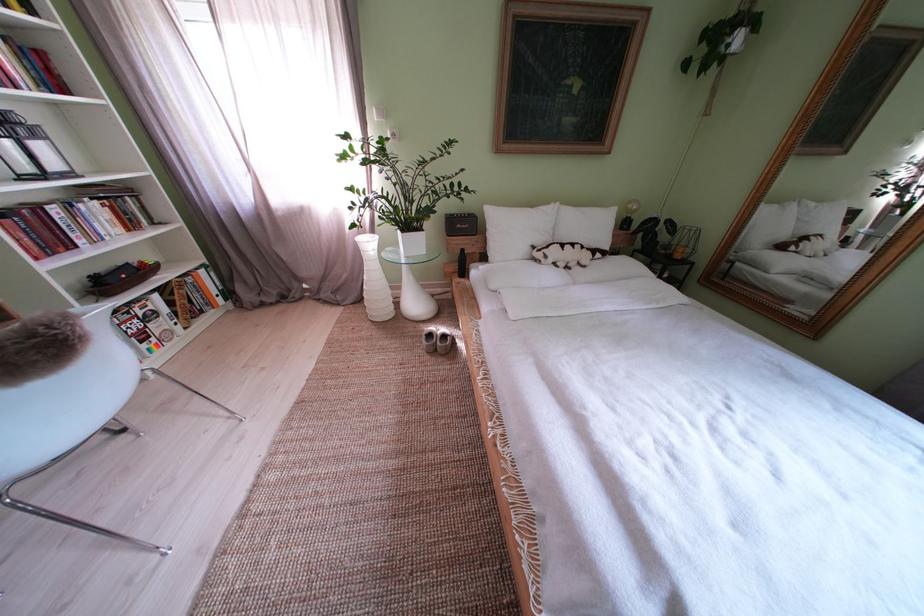
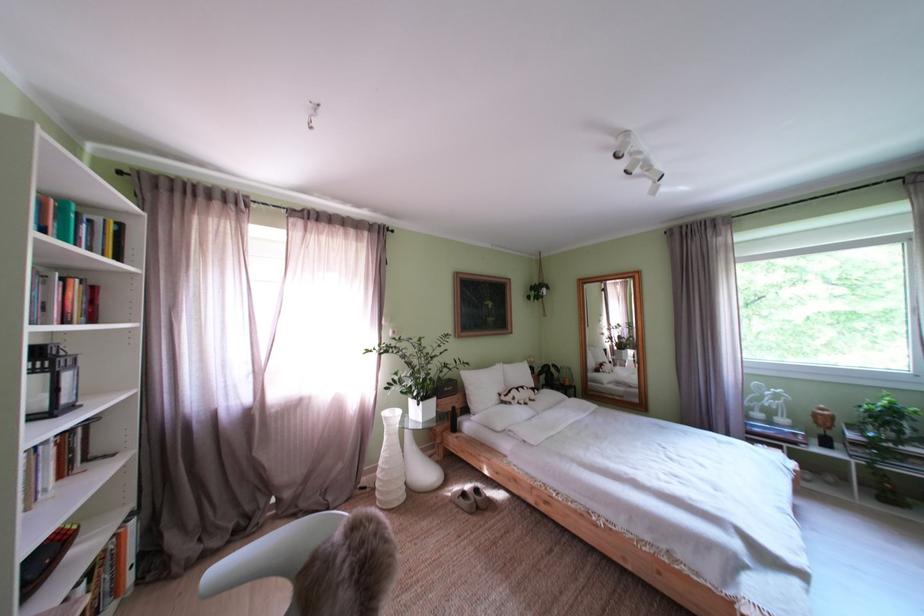
The point at (427, 310) is marked in the first image. Where is the corresponding point in the second image?

(438, 479)